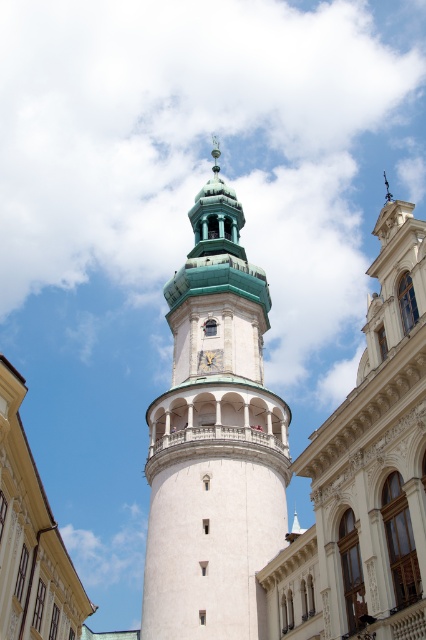
You are standing in front of the tower and want to determine the relative positions of two points marked on the tower. The first point is located at coordinates point (282, 470) and the second at point (423, 602). Which point is closer to you?

Point (282, 470) is closer to you because it is further to the viewer than point (423, 602).

You are standing in front of the tower and want to take a photo that includes both the white stone church at center and the gold textured clock at center. Based on their positions, which one should you place on the left side of your photo to include both in the frame?

The gold textured clock at center should be placed on the left side of the photo because the white stone church at center is positioned on the right side of it.

You are standing in front of a group of buildings. You see a white stone tower at center and a white stone church at center. Which one is higher?

The white stone tower at center is higher than the white stone church at center.